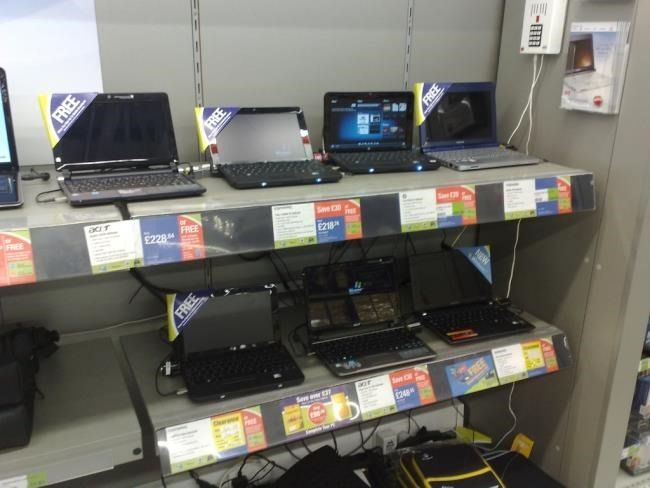
Identify the location of laptop keyboard. (348, 352).